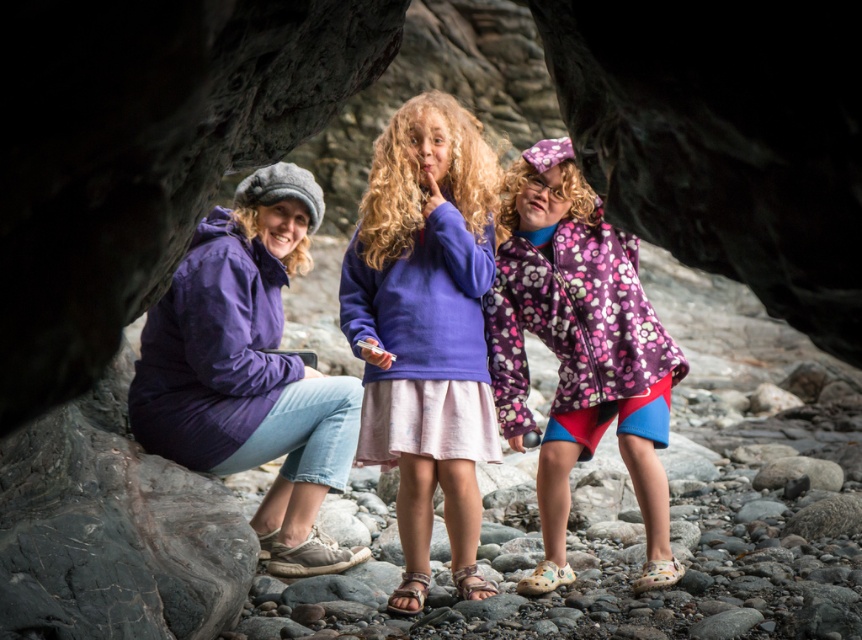
Question: Observing the image, what is the correct spatial positioning of purple fleece jacket at center in reference to floral fleece jacket at center?

Choices:
 (A) above
 (B) below

Answer: (A)

Question: Which of the following is the farthest from the observer?

Choices:
 (A) purple fleece jacket at center
 (B) floral fleece jacket at center

Answer: (B)

Question: Does purple fleece jacket at center have a larger size compared to floral fleece jacket at center?

Choices:
 (A) yes
 (B) no

Answer: (B)

Question: Among these points, which one is farthest from the camera?

Choices:
 (A) (622, 316)
 (B) (453, 248)

Answer: (A)

Question: Which object appears closest to the camera in this image?

Choices:
 (A) floral fleece jacket at center
 (B) purple fleece jacket at center

Answer: (B)

Question: Is purple fleece jacket at center below floral fleece jacket at center?

Choices:
 (A) no
 (B) yes

Answer: (A)